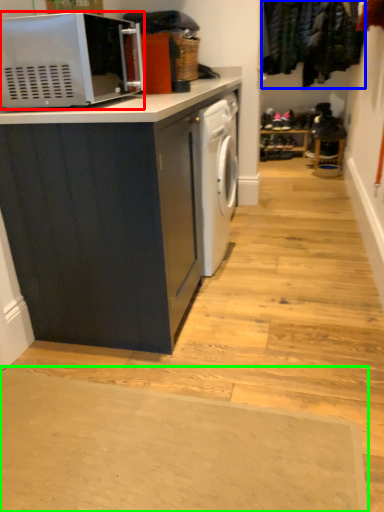
Question: Estimate the real-world distances between objects in this image. Which object is closer to microwave oven (highlighted by a red box), laundry (highlighted by a blue box) or doormat (highlighted by a green box)?

Choices:
 (A) laundry
 (B) doormat

Answer: (B)